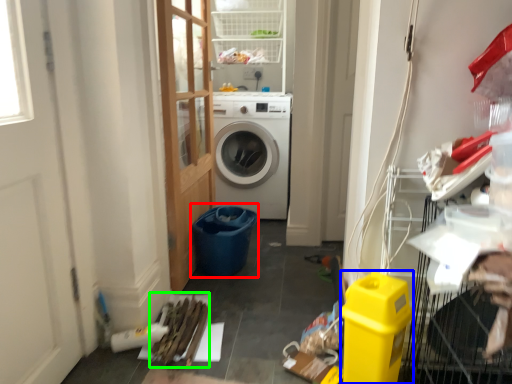
Question: Based on their relative distances, which object is nearer to recycling bin (highlighted by a red box)? Choose from appliance (highlighted by a blue box) and debris (highlighted by a green box).

Choices:
 (A) appliance
 (B) debris

Answer: (B)